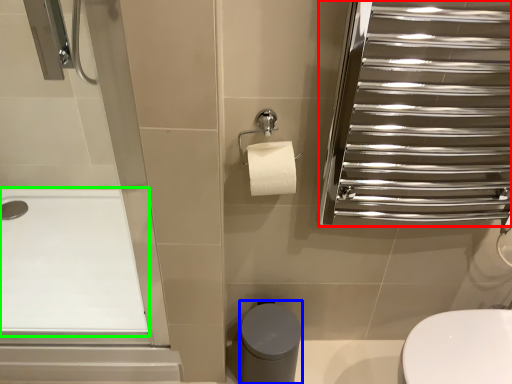
Question: Estimate the real-world distances between objects in this image. Which object is closer to screen door (highlighted by a red box), bidet (highlighted by a blue box) or bath (highlighted by a green box)?

Choices:
 (A) bidet
 (B) bath

Answer: (A)